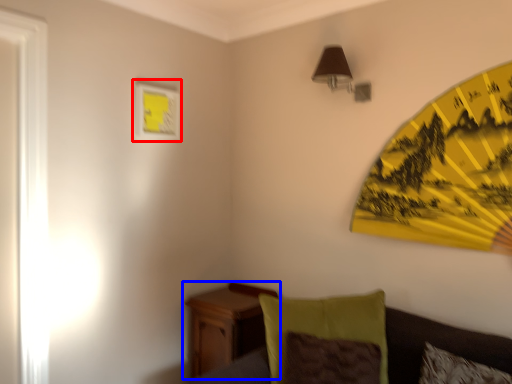
Question: Which object is closer to the camera taking this photo, picture frame (highlighted by a red box) or nightstand (highlighted by a blue box)?

Choices:
 (A) picture frame
 (B) nightstand

Answer: (B)